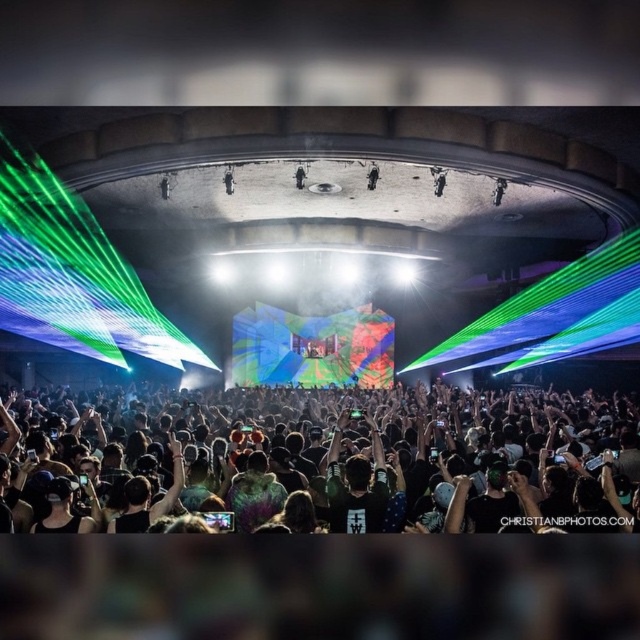
Question: Which of these objects is positioned closest to the dark hair at lower center?

Choices:
 (A) dark green t-shirt at center
 (B) black matte person at upper center

Answer: (A)

Question: Which object is farther from the camera taking this photo?

Choices:
 (A) black matte person at upper center
 (B) dark green t-shirt at center
 (C) dark hair at lower center

Answer: (A)

Question: Does dark hair at lower center appear on the left side of dark green t-shirt at center?

Choices:
 (A) yes
 (B) no

Answer: (A)

Question: Can you confirm if dark hair at lower center is positioned to the left of dark green t-shirt at center?

Choices:
 (A) no
 (B) yes

Answer: (B)

Question: Is dark hair at lower center bigger than black matte person at upper center?

Choices:
 (A) yes
 (B) no

Answer: (A)

Question: Which of the following is the farthest from the observer?

Choices:
 (A) [x=545, y=497]
 (B) [x=385, y=483]

Answer: (B)